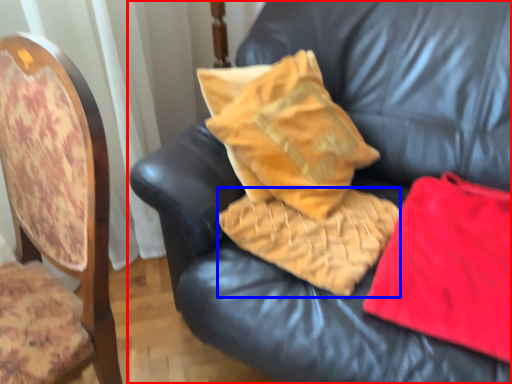
Question: Among these objects, which one is farthest to the camera, furniture (highlighted by a red box) or material (highlighted by a blue box)?

Choices:
 (A) furniture
 (B) material

Answer: (B)